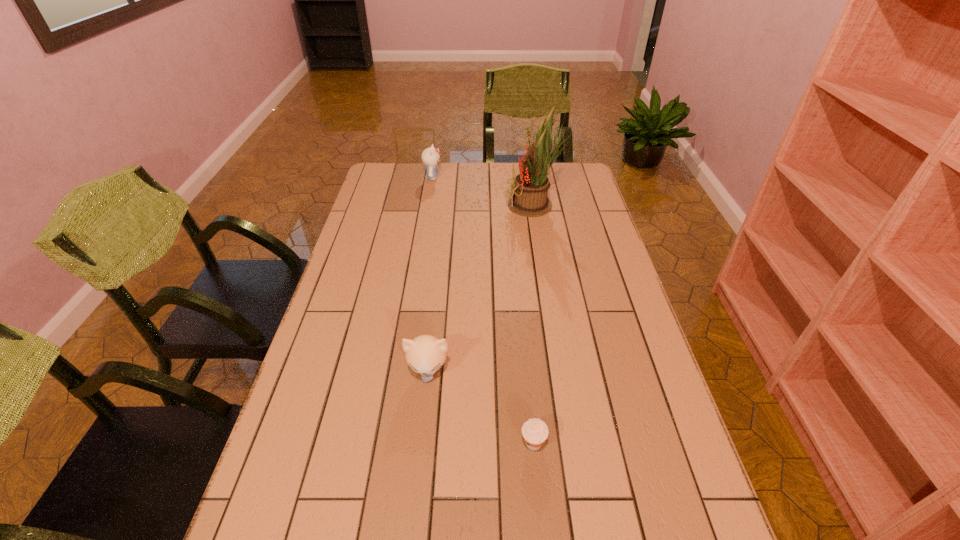
In order to click on the second farthest object in this screenshot , I will do `click(530, 188)`.

I want to click on the tallest object, so click(x=530, y=188).

Where is `the farthest object`? This screenshot has height=540, width=960. the farthest object is located at coordinates (430, 156).

The image size is (960, 540). What are the coordinates of `the nearer kitten` in the screenshot? It's located at (425, 354).

Locate an element on the screen. This screenshot has width=960, height=540. the nearest object is located at coordinates (535, 432).

The height and width of the screenshot is (540, 960). Identify the location of muffin. (535, 432).

Where is `vacant point located in front of the third nearest object with the fan visible`? The width and height of the screenshot is (960, 540). vacant point located in front of the third nearest object with the fan visible is located at coordinates (455, 206).

At what (x,y) coordinates should I click in order to perform the action: click on vacant space located in front of the third nearest object with the fan visible. Please return your answer as a coordinate pair (x, y). The image size is (960, 540). Looking at the image, I should click on (455, 206).

The width and height of the screenshot is (960, 540). I want to click on vacant region located 0.250m in front of the third nearest object with the fan visible, so pos(440,206).

Identify the location of vacant space located 0.310m on the front-facing side of the farther kitten. (516, 178).